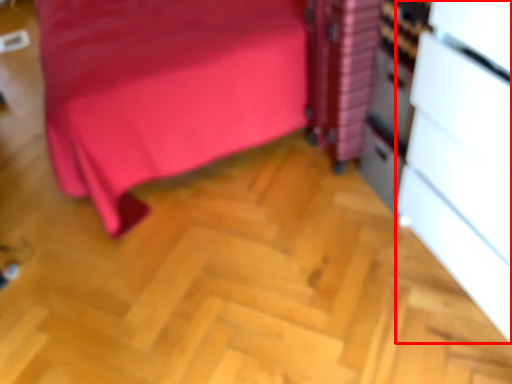
Question: From the image, what is the correct spatial relationship of file cabinet (annotated by the red box) in relation to file cabinet?

Choices:
 (A) right
 (B) left

Answer: (A)